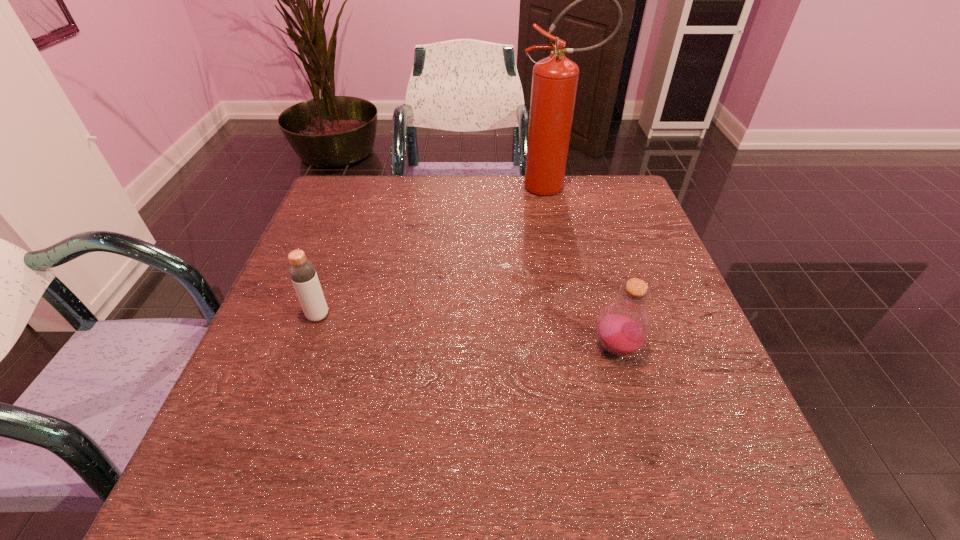
Where is `free region located on the right of the leftmost object`? free region located on the right of the leftmost object is located at coordinates (437, 315).

Locate an element on the screen. object present at the far edge is located at coordinates (555, 78).

Locate an element on the screen. object located at the left edge is located at coordinates coord(302,272).

Identify the location of fire extinguisher located in the right edge section of the desktop. The width and height of the screenshot is (960, 540). (555, 78).

You are a GUI agent. You are given a task and a screenshot of the screen. Output one action in this format:
    pyautogui.click(x=<x>, y=<y>)
    Task: Click on the bottle present at the right edge
    This screenshot has height=540, width=960.
    Given the screenshot: What is the action you would take?
    pyautogui.click(x=624, y=326)

Locate an element on the screen. The width and height of the screenshot is (960, 540). object present at the far right corner is located at coordinates (555, 78).

Locate an element on the screen. This screenshot has height=540, width=960. vacant position at the far edge of the desktop is located at coordinates (425, 215).

Locate an element on the screen. Image resolution: width=960 pixels, height=540 pixels. vacant space at the near edge of the desktop is located at coordinates (569, 491).

Where is `vacant space at the left edge of the desktop`? vacant space at the left edge of the desktop is located at coordinates (299, 332).

Identify the location of free space at the right edge of the desktop. (649, 419).